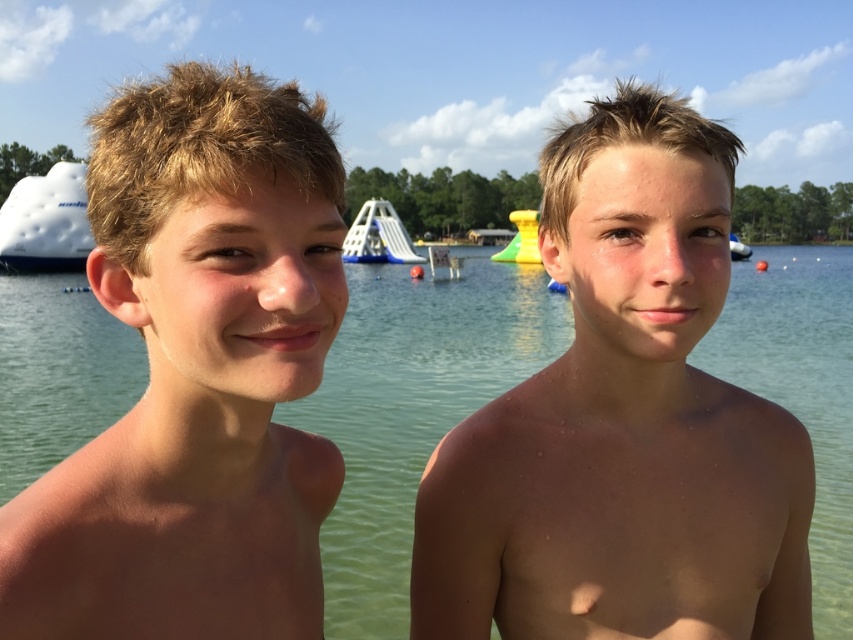
Question: Which point is farther from the camera taking this photo?

Choices:
 (A) (173, 337)
 (B) (514, 243)
 (C) (593, 268)

Answer: (B)

Question: From the image, what is the correct spatial relationship of white matte boat at left in relation to white plastic slide at center?

Choices:
 (A) below
 (B) above

Answer: (A)

Question: Which is nearer to the white glossy boat at upper center?

Choices:
 (A) yellow rubber boat at center
 (B) white matte boat at left
 (C) clear water at center
 (D) dry skin boy at center

Answer: (A)

Question: Does golden hair at center appear under white glossy boat at upper center?

Choices:
 (A) no
 (B) yes

Answer: (B)

Question: Which of these objects is positioned closest to the white glossy boat at upper center?

Choices:
 (A) white matte boat at left
 (B) dry skin boy at center
 (C) white plastic slide at center
 (D) yellow rubber boat at center

Answer: (D)

Question: Is golden hair at center thinner than white glossy boat at upper center?

Choices:
 (A) no
 (B) yes

Answer: (B)